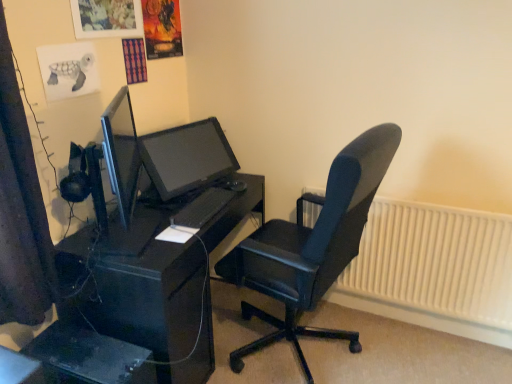
Where is `vacant space that is in between black leather office chair at center and white plastic radiator at right`? This screenshot has height=384, width=512. vacant space that is in between black leather office chair at center and white plastic radiator at right is located at coordinates (421, 354).